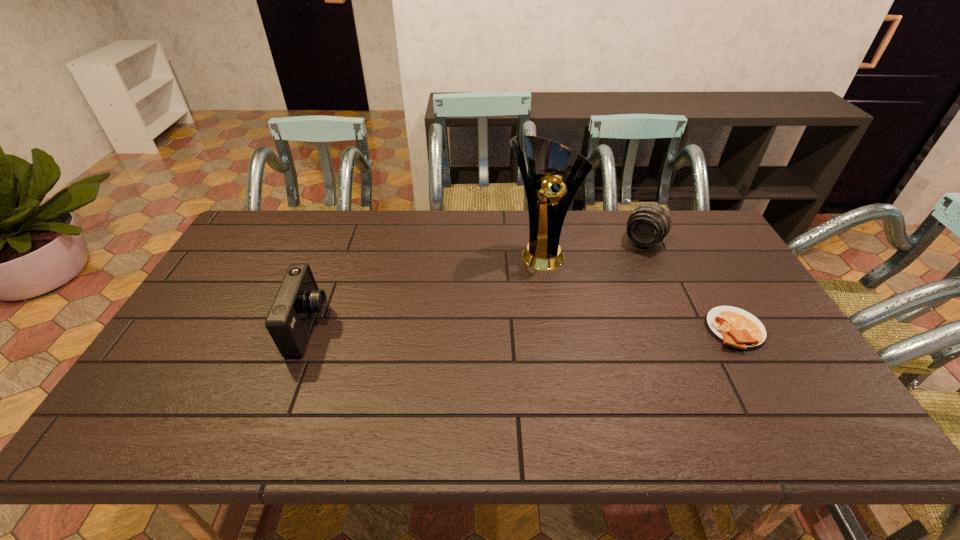
This screenshot has width=960, height=540. In order to click on vacant space at the near right corner of the desktop in this screenshot , I will do `click(767, 385)`.

This screenshot has height=540, width=960. What are the coordinates of `vacant region between the leftmost object and the telephoto lens` in the screenshot? It's located at (476, 285).

Locate an element on the screen. This screenshot has height=540, width=960. vacant area that lies between the omelet and the leftmost object is located at coordinates (522, 329).

Identify the location of empty location between the camera and the telephoto lens. The height and width of the screenshot is (540, 960). [x=476, y=285].

Locate an element on the screen. vacant space that is in between the telephoto lens and the leftmost object is located at coordinates (476, 285).

Image resolution: width=960 pixels, height=540 pixels. Find the location of `vacant space that's between the shortest object and the third object from right to left`. vacant space that's between the shortest object and the third object from right to left is located at coordinates (638, 291).

Where is `vacant area between the camera and the award`? This screenshot has height=540, width=960. vacant area between the camera and the award is located at coordinates (425, 289).

At what (x,y) coordinates should I click in order to perform the action: click on free point between the telephoto lens and the third object from right to left. Please return your answer as a coordinate pair (x, y). The image size is (960, 540). Looking at the image, I should click on (592, 246).

The width and height of the screenshot is (960, 540). In order to click on free spot between the shortest object and the award in this screenshot , I will do `click(638, 291)`.

Identify the location of vacant area that lies between the telephoto lens and the leftmost object. (476, 285).